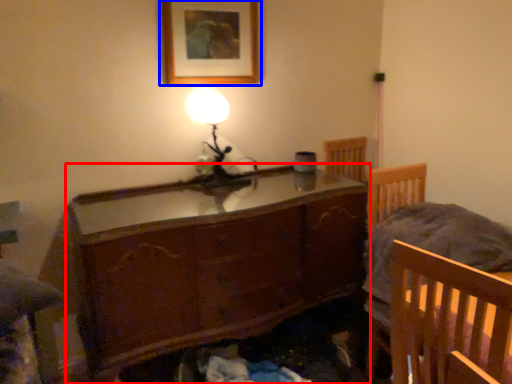
Question: Which object is further to the camera taking this photo, chest of drawers (highlighted by a red box) or picture frame (highlighted by a blue box)?

Choices:
 (A) chest of drawers
 (B) picture frame

Answer: (B)